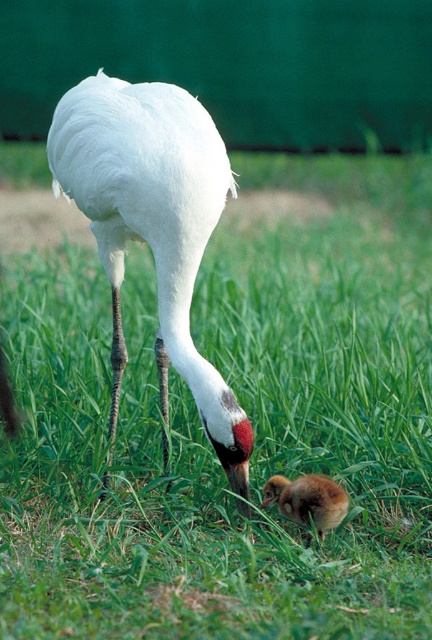
Question: Does white feathered crane at center have a larger size compared to brown fluffy chick at lower center?

Choices:
 (A) no
 (B) yes

Answer: (B)

Question: Considering the relative positions of white feathered crane at center and brown fluffy chick at lower center in the image provided, where is white feathered crane at center located with respect to brown fluffy chick at lower center?

Choices:
 (A) right
 (B) left

Answer: (B)

Question: Can you confirm if white feathered crane at center is thinner than brown fluffy chick at lower center?

Choices:
 (A) yes
 (B) no

Answer: (B)

Question: Which point is farther to the camera?

Choices:
 (A) (327, 531)
 (B) (197, 410)

Answer: (A)